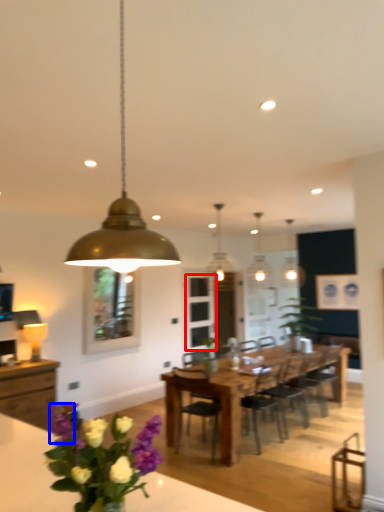
Question: Which of the following is the closest to the observer, glass door (highlighted by a red box) or flower (highlighted by a blue box)?

Choices:
 (A) glass door
 (B) flower

Answer: (B)